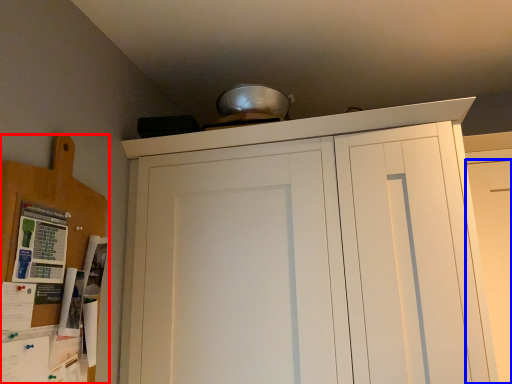
Question: Which point is closer to the camera, cabinetry (highlighted by a red box) or door (highlighted by a blue box)?

Choices:
 (A) cabinetry
 (B) door

Answer: (A)